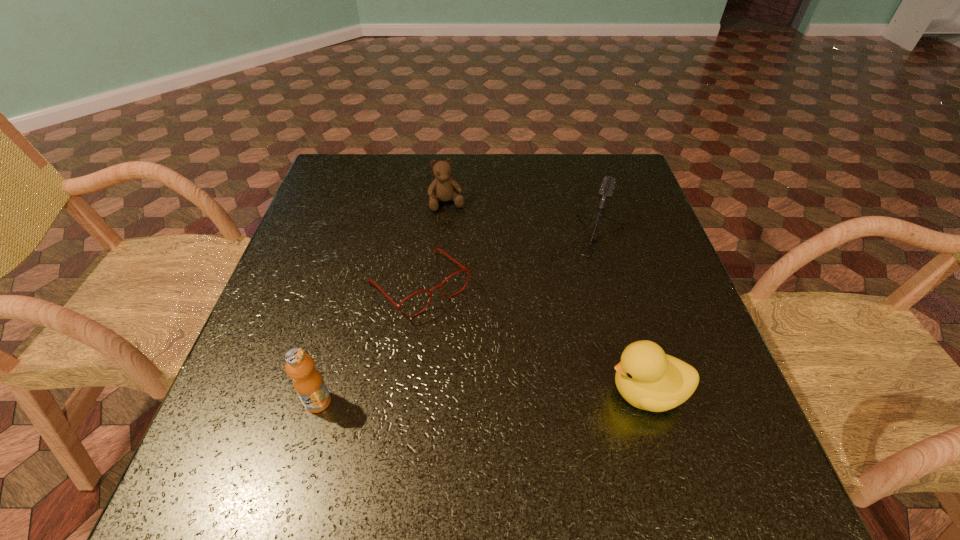
Where is `free region at the near right corner of the desktop`? The image size is (960, 540). free region at the near right corner of the desktop is located at coordinates (692, 424).

Locate an element on the screen. free space between the orange juice and the farthest object is located at coordinates (383, 302).

Identify the location of vacant area that lies between the duck and the spectacles. The height and width of the screenshot is (540, 960). (533, 339).

Where is `vacant region between the duck and the orange juice`? This screenshot has height=540, width=960. vacant region between the duck and the orange juice is located at coordinates (482, 397).

Locate an element on the screen. free spot between the duck and the microphone is located at coordinates [618, 318].

The width and height of the screenshot is (960, 540). I want to click on vacant space that's between the teddy bear and the duck, so click(x=547, y=298).

Where is `empty location between the duck and the farthest object`? This screenshot has width=960, height=540. empty location between the duck and the farthest object is located at coordinates pyautogui.click(x=547, y=298).

Where is `vacant area that lies between the spectacles and the orange juice`? Image resolution: width=960 pixels, height=540 pixels. vacant area that lies between the spectacles and the orange juice is located at coordinates (369, 343).

The height and width of the screenshot is (540, 960). In order to click on vacant space that is in between the duck and the shortest object in this screenshot , I will do `click(533, 339)`.

You are a GUI agent. You are given a task and a screenshot of the screen. Output one action in this format:
    pyautogui.click(x=<x>, y=<y>)
    Task: Click on the vacant point located between the microphone and the orange juice
    This screenshot has width=960, height=540.
    Given the screenshot: What is the action you would take?
    pyautogui.click(x=454, y=322)